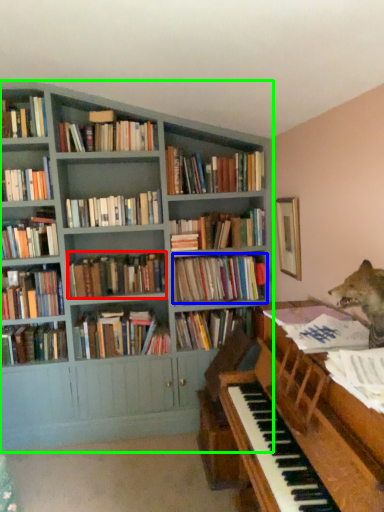
Question: Which object is positioned farthest from book (highlighted by a red box)? Select from book (highlighted by a blue box) and bookcase (highlighted by a green box).

Choices:
 (A) book
 (B) bookcase

Answer: (B)